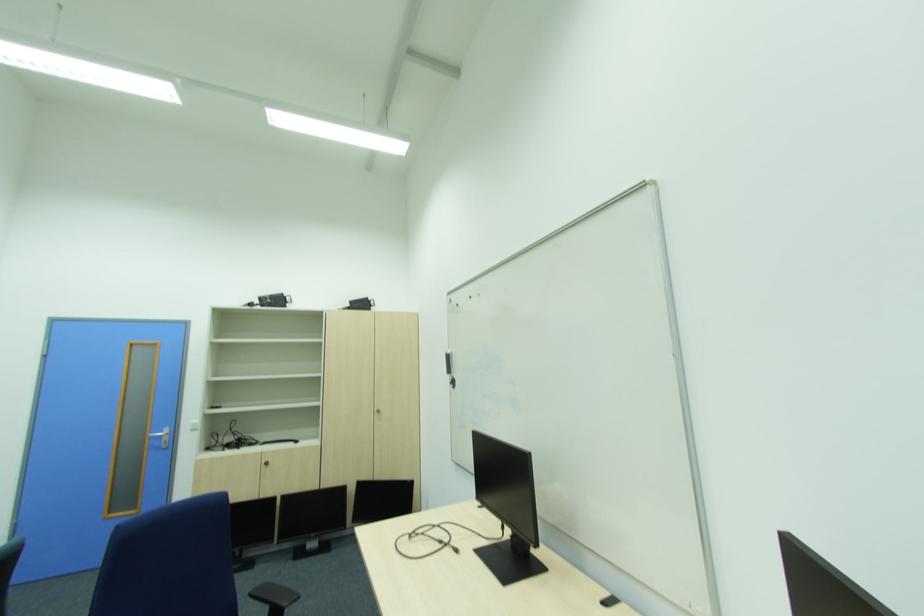
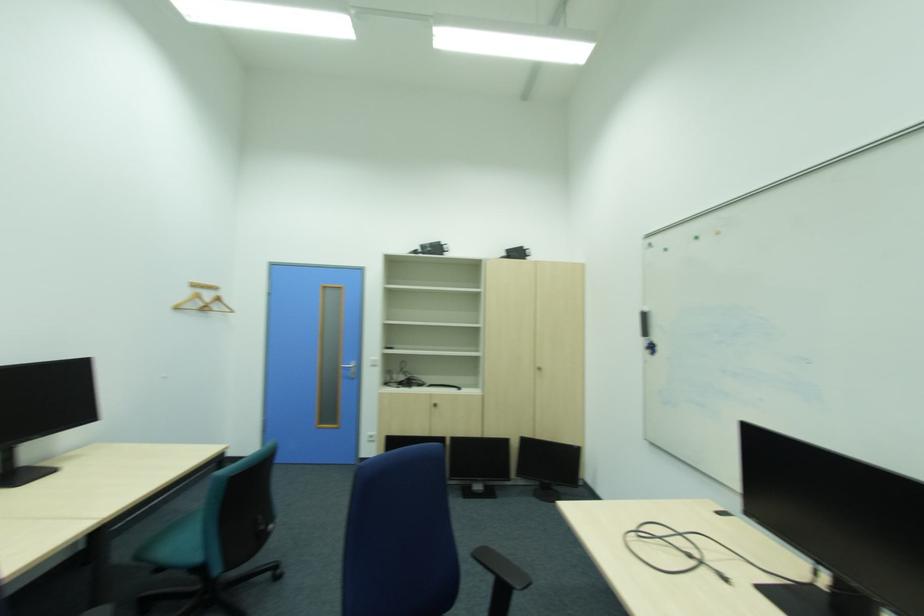
Where in the second image is the point corresponding to (506,522) from the first image?

(815, 561)